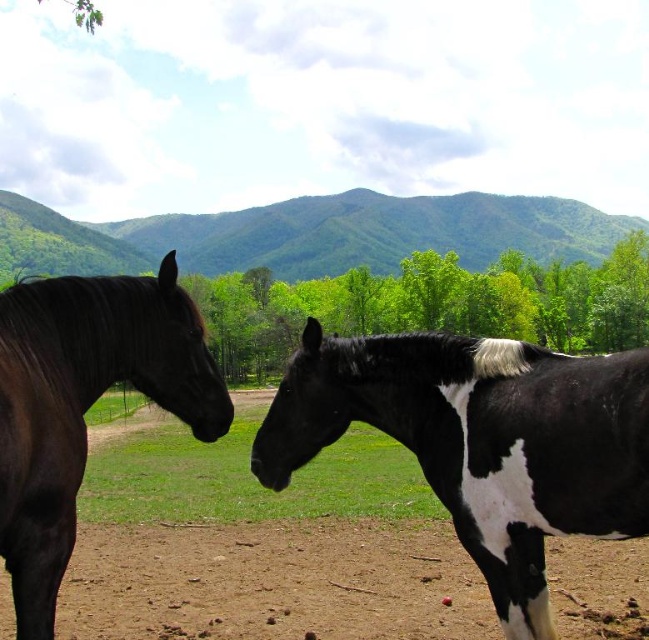
You are a photographer aiming to capture both the black and white speckled horse at center and the shiny dark brown horse at left in a single frame. Based on their positions, which horse would appear closer to the camera in the photo?

The black and white speckled horse at center is located below the shiny dark brown horse at left, so the shiny dark brown horse at left would appear closer to the camera in the photo.

You are a photographer positioned behind both horses and want to take a photo that includes both the black and white speckled horse at center and the shiny dark brown horse at left. Which horse will appear closer to the camera in the photo?

The black and white speckled horse at center will appear closer to the camera in the photo because it is positioned further to the viewer than the shiny dark brown horse at left.

You are a photographer trying to capture both the black and white speckled horse at center and the shiny dark brown horse at left in a single frame. Based on their positions, which horse should you adjust your camera to focus on first to ensure both are in the shot?

You should focus on the shiny dark brown horse at left first because the black and white speckled horse at center is to the right of it, so adjusting the camera to include both would require starting from the leftmost subject.